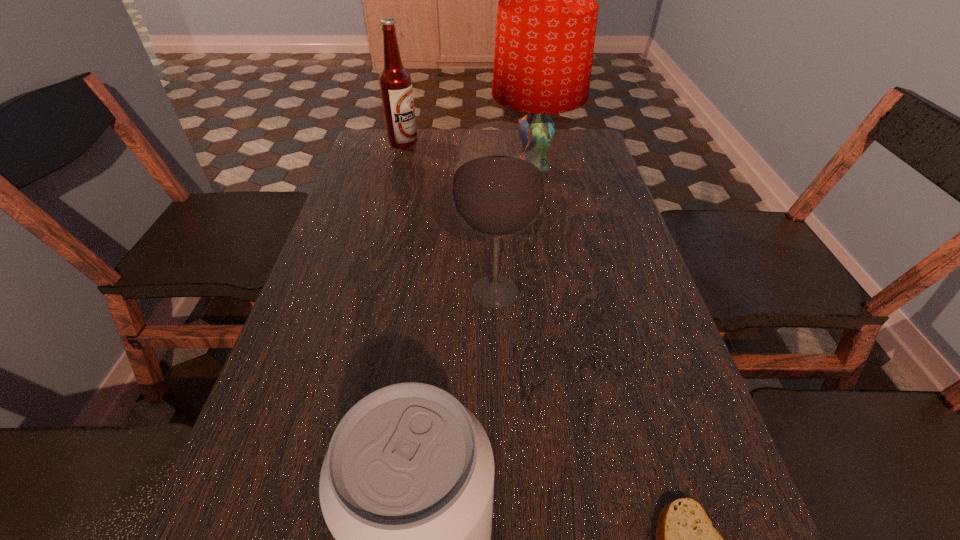
Image resolution: width=960 pixels, height=540 pixels. I want to click on object at the right edge, so click(546, 24).

Image resolution: width=960 pixels, height=540 pixels. In order to click on object at the far left corner in this screenshot , I will do `click(395, 82)`.

Where is `object located at the far right corner`? The width and height of the screenshot is (960, 540). object located at the far right corner is located at coordinates (546, 24).

This screenshot has height=540, width=960. In order to click on vacant space at the far edge of the desktop in this screenshot , I will do `click(437, 131)`.

Find the location of `vacant space at the left edge of the desktop`. vacant space at the left edge of the desktop is located at coordinates (390, 168).

Identify the location of vacant space at the right edge of the desktop. (562, 177).

Identify the location of object that is the fourth closest to the second farthest alcohol. The image size is (960, 540). (395, 82).

You are a GUI agent. You are given a task and a screenshot of the screen. Output one action in this format:
    pyautogui.click(x=<x>, y=<y>)
    Task: Click on the fourth closest object to the tallest object
    The width and height of the screenshot is (960, 540).
    Given the screenshot: What is the action you would take?
    pyautogui.click(x=685, y=537)

You are a GUI agent. You are given a task and a screenshot of the screen. Output one action in this format:
    pyautogui.click(x=<x>, y=<y>)
    Task: Click on the alcohol that stands as the second closest to the farthest alcohol
    The image size is (960, 540).
    Given the screenshot: What is the action you would take?
    pyautogui.click(x=406, y=487)

Select which alcohol appears as the closest to the pita bread. Please provide its 2D coordinates. Your answer should be formatted as a tuple, i.e. [(x, y)], where the tuple contains the x and y coordinates of a point satisfying the conditions above.

[(406, 487)]